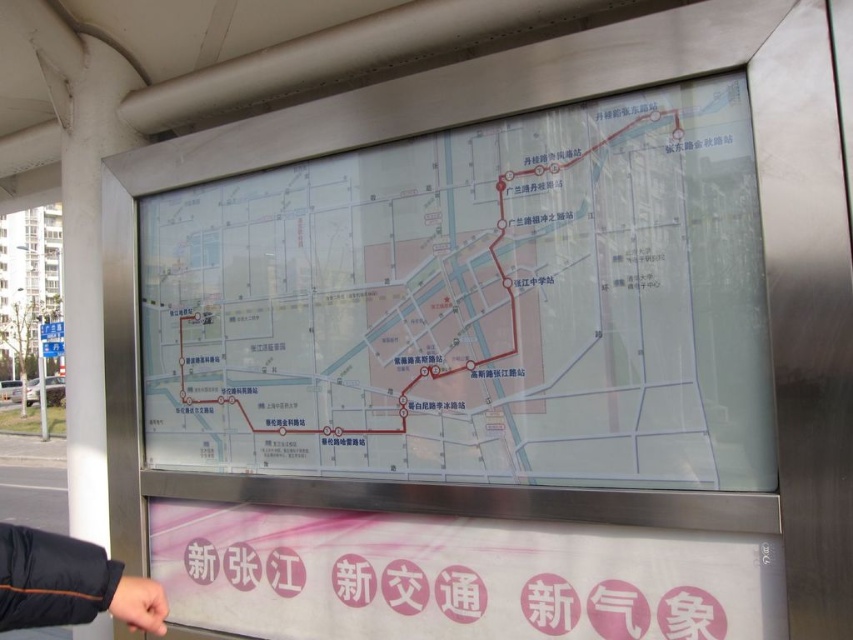
Question: Which of the following is the farthest from the observer?

Choices:
 (A) transparent plastic map at center
 (B) black fabric sleeve at lower left

Answer: (A)

Question: Among these objects, which one is nearest to the camera?

Choices:
 (A) transparent plastic map at center
 (B) black fabric sleeve at lower left

Answer: (B)

Question: Among these points, which one is nearest to the camera?

Choices:
 (A) (286, 445)
 (B) (68, 609)

Answer: (B)

Question: Is transparent plastic map at center wider than black fabric sleeve at lower left?

Choices:
 (A) yes
 (B) no

Answer: (A)

Question: Can you confirm if transparent plastic map at center is positioned above black fabric sleeve at lower left?

Choices:
 (A) yes
 (B) no

Answer: (A)

Question: Is transparent plastic map at center further to camera compared to black fabric sleeve at lower left?

Choices:
 (A) no
 (B) yes

Answer: (B)